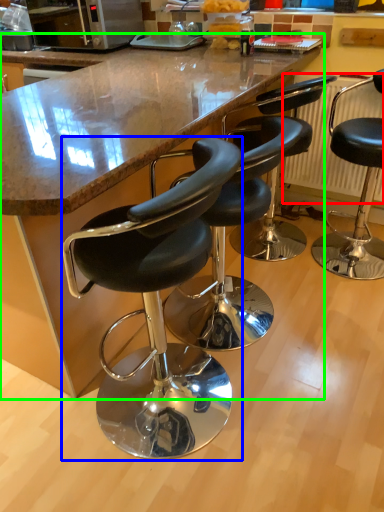
Question: Estimate the real-world distances between objects in this image. Which object is closer to radiator (highlighted by a red box), chair (highlighted by a blue box) or counter (highlighted by a green box)?

Choices:
 (A) chair
 (B) counter

Answer: (B)